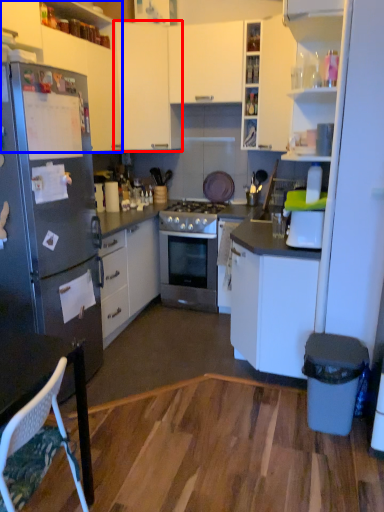
Question: Among these objects, which one is nearest to the camera, cabinetry (highlighted by a red box) or cabinetry (highlighted by a blue box)?

Choices:
 (A) cabinetry
 (B) cabinetry

Answer: (B)